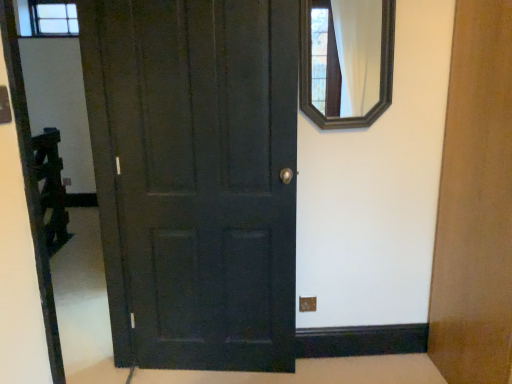
Describe the element at coordinates (348, 54) in the screenshot. I see `wooden-framed mirror at upper right` at that location.

Find the location of `wooden-framed mirror at upper right`. wooden-framed mirror at upper right is located at coordinates (348, 54).

Where is `matte dark wood door at center`? This screenshot has height=384, width=512. matte dark wood door at center is located at coordinates (196, 177).

Describe the element at coordinates (196, 177) in the screenshot. This screenshot has width=512, height=384. I see `matte dark wood door at center` at that location.

What is the approximate width of matte dark wood door at center?

matte dark wood door at center is 4.01 inches wide.

In order to face matte dark wood door at center, should I rotate leftwards or rightwards?

A 6.567 degree turn to the left will do.

Where is `wooden-framed mirror at upper right`? The image size is (512, 384). wooden-framed mirror at upper right is located at coordinates (348, 54).

Which object is positioned more to the right, matte dark wood door at center or wooden-framed mirror at upper right?

Positioned to the right is wooden-framed mirror at upper right.

Which object is more forward, matte dark wood door at center or wooden-framed mirror at upper right?

matte dark wood door at center is closer to the camera.

Between point (170, 247) and point (377, 71), which one is positioned behind?

The point (170, 247) is farther from the camera.

Looking at this image, from the image's perspective, which is below, matte dark wood door at center or wooden-framed mirror at upper right?

matte dark wood door at center is shown below in the image.

From a real-world perspective, is matte dark wood door at center positioned over wooden-framed mirror at upper right based on gravity?

Incorrect, from a real-world perspective, matte dark wood door at center is lower than wooden-framed mirror at upper right.

Which object is wider, matte dark wood door at center or wooden-framed mirror at upper right?

Wider between the two is matte dark wood door at center.

From the picture: Does matte dark wood door at center have a greater height compared to wooden-framed mirror at upper right?

Yes.

Considering the sizes of objects matte dark wood door at center and wooden-framed mirror at upper right in the image provided, who is smaller, matte dark wood door at center or wooden-framed mirror at upper right?

Smaller between the two is wooden-framed mirror at upper right.

Choose the correct answer: Is matte dark wood door at center inside wooden-framed mirror at upper right or outside it?

The correct answer is: outside.

Is there a large distance between matte dark wood door at center and wooden-framed mirror at upper right?

They are positioned close to each other.

Is wooden-framed mirror at upper right at the back of matte dark wood door at center?

matte dark wood door at center is not turned away from wooden-framed mirror at upper right.

What's the angular difference between matte dark wood door at center and wooden-framed mirror at upper right's facing directions?

matte dark wood door at center and wooden-framed mirror at upper right are facing 6.12 degrees away from each other.

How far apart are matte dark wood door at center and wooden-framed mirror at upper right?

22.01 inches.

The height and width of the screenshot is (384, 512). Find the location of `mirror located on the right of matte dark wood door at center`. mirror located on the right of matte dark wood door at center is located at coordinates (348, 54).

Based on their positions, is wooden-framed mirror at upper right located to the left or right of matte dark wood door at center?

In the image, wooden-framed mirror at upper right appears on the right side of matte dark wood door at center.

Relative to matte dark wood door at center, is wooden-framed mirror at upper right in front or behind?

wooden-framed mirror at upper right is positioned farther from the viewer than matte dark wood door at center.

Does point (366, 98) come farther from viewer compared to point (120, 90)?

Yes.

Based on the photo, from the image's perspective, which one is positioned higher, wooden-framed mirror at upper right or matte dark wood door at center?

wooden-framed mirror at upper right, from the image's perspective.

From a real-world perspective, who is located higher, wooden-framed mirror at upper right or matte dark wood door at center?

wooden-framed mirror at upper right.

Considering the relative sizes of wooden-framed mirror at upper right and matte dark wood door at center in the image provided, is wooden-framed mirror at upper right wider than matte dark wood door at center?

In fact, wooden-framed mirror at upper right might be narrower than matte dark wood door at center.

From their relative heights in the image, would you say wooden-framed mirror at upper right is taller or shorter than matte dark wood door at center?

wooden-framed mirror at upper right is shorter than matte dark wood door at center.

Considering the relative sizes of wooden-framed mirror at upper right and matte dark wood door at center in the image provided, is wooden-framed mirror at upper right smaller than matte dark wood door at center?

Yes.

Is matte dark wood door at center completely or partially inside wooden-framed mirror at upper right?

No, matte dark wood door at center is not a part of wooden-framed mirror at upper right.

Is wooden-framed mirror at upper right with matte dark wood door at center?

wooden-framed mirror at upper right and matte dark wood door at center are not in contact.

Is wooden-framed mirror at upper right oriented towards matte dark wood door at center?

No, wooden-framed mirror at upper right is not oriented towards matte dark wood door at center.

How many degrees apart are the facing directions of wooden-framed mirror at upper right and matte dark wood door at center?

The angle between the facing direction of wooden-framed mirror at upper right and the facing direction of matte dark wood door at center is 6.12 degrees.

You are a GUI agent. You are given a task and a screenshot of the screen. Output one action in this format:
    pyautogui.click(x=<x>, y=<y>)
    Task: Click on the mirror on the right of matte dark wood door at center
    The image size is (512, 384).
    Given the screenshot: What is the action you would take?
    pyautogui.click(x=348, y=54)

At what (x,y) coordinates should I click in order to perform the action: click on mirror located behind the matte dark wood door at center. Please return your answer as a coordinate pair (x, y). Image resolution: width=512 pixels, height=384 pixels. Looking at the image, I should click on (348, 54).

Where is `mirror above the matte dark wood door at center (from the image's perspective)`? mirror above the matte dark wood door at center (from the image's perspective) is located at coordinates (348, 54).